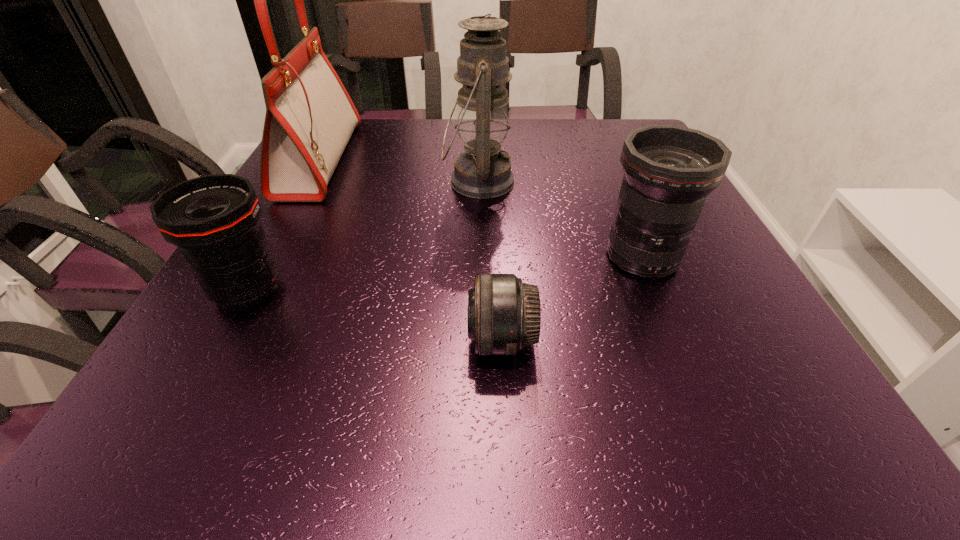
Locate an element on the screen. This screenshot has width=960, height=540. handbag is located at coordinates (310, 117).

Locate an element on the screen. oil lamp is located at coordinates point(482,172).

Where is `the tallest telephoto lens`? the tallest telephoto lens is located at coordinates (669, 170).

You are a GUI agent. You are given a task and a screenshot of the screen. Output one action in this format:
    pyautogui.click(x=<x>, y=<y>)
    Task: Click on the third tallest object
    Image resolution: width=960 pixels, height=540 pixels.
    Given the screenshot: What is the action you would take?
    pyautogui.click(x=669, y=170)

Locate an element on the screen. The height and width of the screenshot is (540, 960). the leftmost telephoto lens is located at coordinates (214, 219).

I want to click on the second tallest telephoto lens, so click(x=214, y=219).

At what (x,y) coordinates should I click in order to perform the action: click on the shortest telephoto lens. Please return your answer as a coordinate pair (x, y). The image size is (960, 540). Looking at the image, I should click on [x=504, y=314].

Locate an element on the screen. The width and height of the screenshot is (960, 540). the shortest object is located at coordinates (504, 314).

The height and width of the screenshot is (540, 960). Find the location of `free space located 0.390m on the right of the tallest object`. free space located 0.390m on the right of the tallest object is located at coordinates click(497, 160).

Locate an element on the screen. The width and height of the screenshot is (960, 540). vacant region located on the right of the second tallest object is located at coordinates pos(564,181).